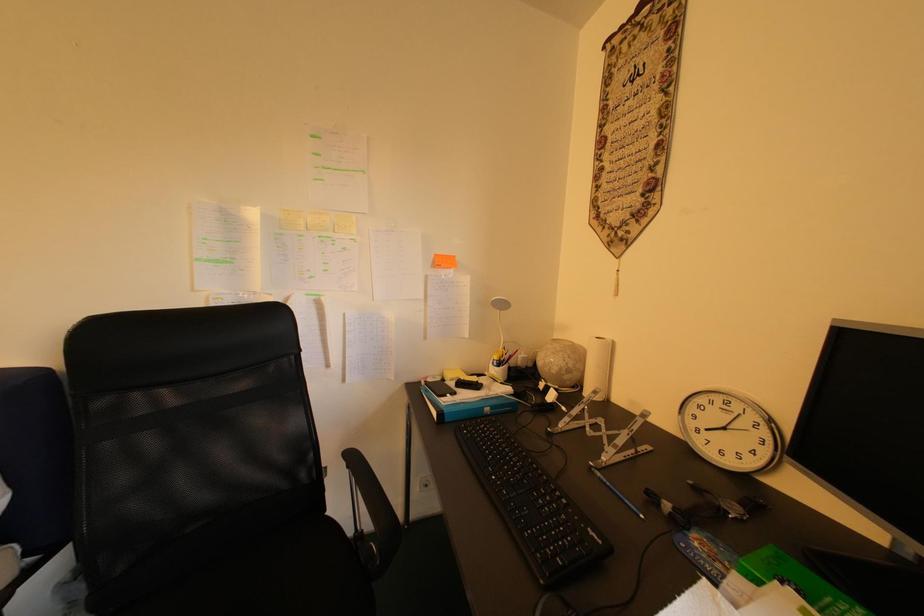
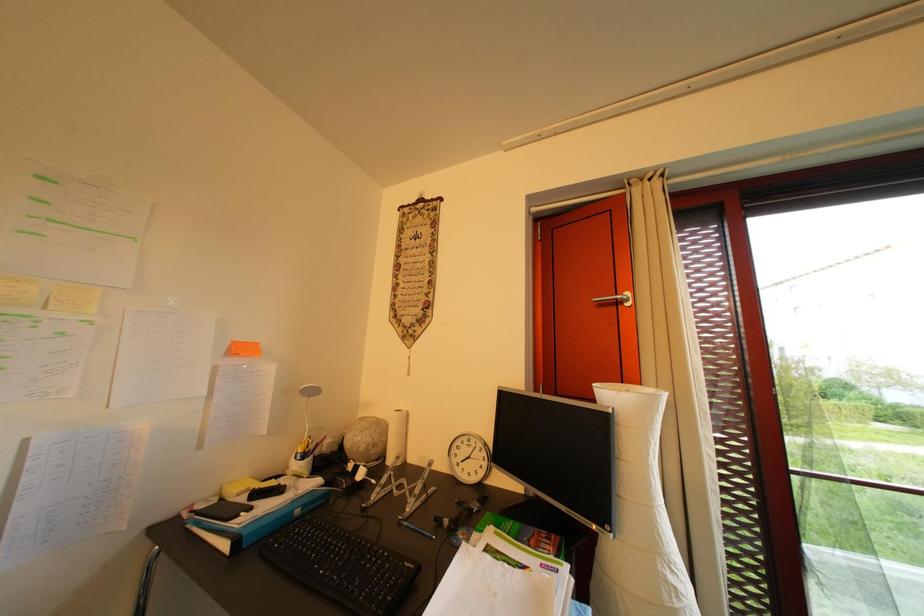
Question: The images are taken continuously from a first-person perspective. In which direction is your viewpoint rotating?

Choices:
 (A) Left
 (B) Right
 (C) Up
 (D) Down

Answer: (B)